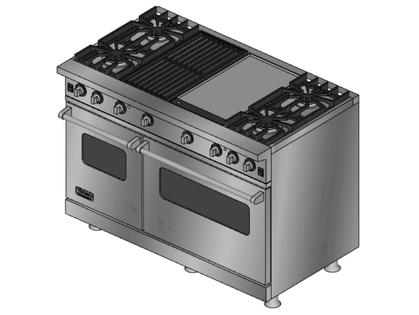
Find the location of a particular element. This screenshot has height=315, width=419. right front hob plate is located at coordinates (265, 121).